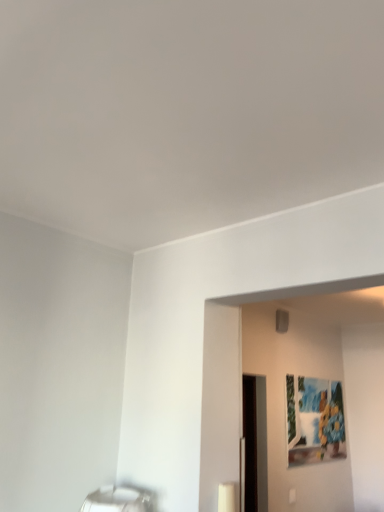
Measure the distance between point (x=334, y=457) and camera.

Point (x=334, y=457) is 3.38 meters away from camera.

Measure the distance between painted wood picture frame at upper right and camera.

painted wood picture frame at upper right and camera are 2.92 meters apart from each other.

What do you see at coordinates (314, 420) in the screenshot? I see `painted wood picture frame at upper right` at bounding box center [314, 420].

Locate an element on the screen. painted wood picture frame at upper right is located at coordinates (314, 420).

The image size is (384, 512). I want to click on painted wood picture frame at upper right, so click(314, 420).